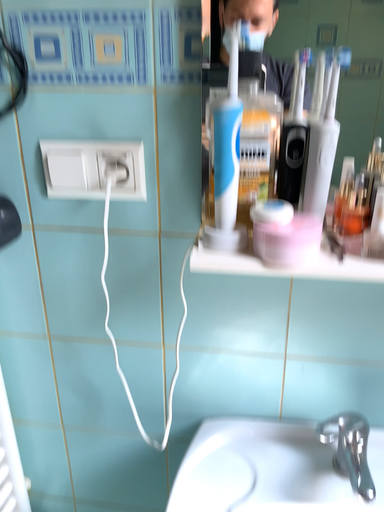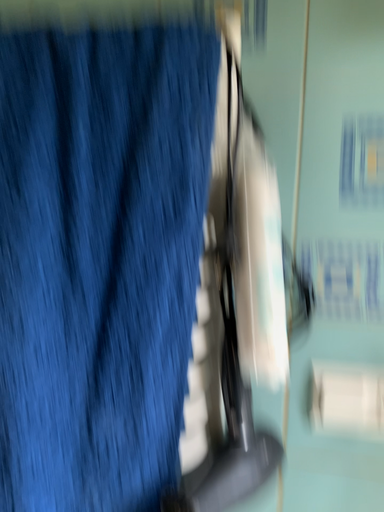
Question: Which way did the camera rotate in the video?

Choices:
 (A) rotated downward
 (B) rotated upward

Answer: (B)